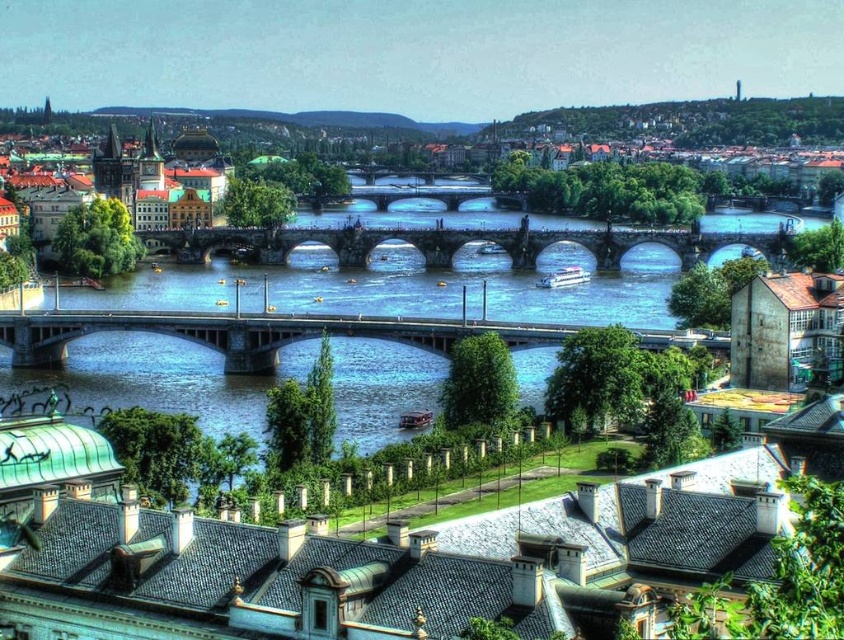
You are a tourist standing on the left bank of the river and want to cross to the right bank. You see the concrete bridge at center and the stone arch bridge at center. Which bridge is closer to your current position?

The concrete bridge at center is positioned on the left side of stone arch bridge at center, so it is closer to your current position on the left bank.